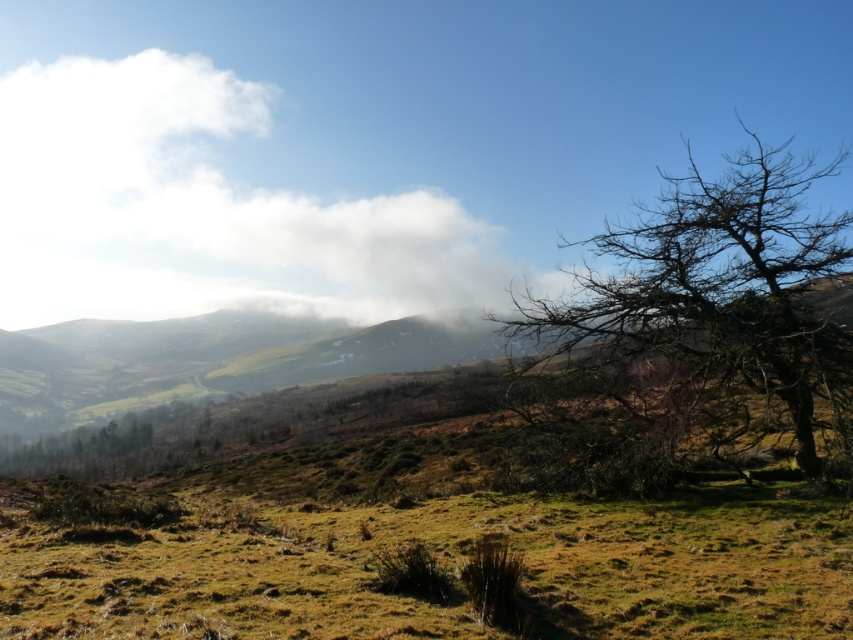
Describe the element at coordinates (204, 209) in the screenshot. I see `white fluffy cloud at upper left` at that location.

Is white fluffy cloud at upper left to the left of bare branches at right from the viewer's perspective?

Indeed, white fluffy cloud at upper left is positioned on the left side of bare branches at right.

Does point (33, 301) lie in front of point (720, 189)?

No, it is behind (720, 189).

Where is `white fluffy cloud at upper left`? The height and width of the screenshot is (640, 853). white fluffy cloud at upper left is located at coordinates click(x=204, y=209).